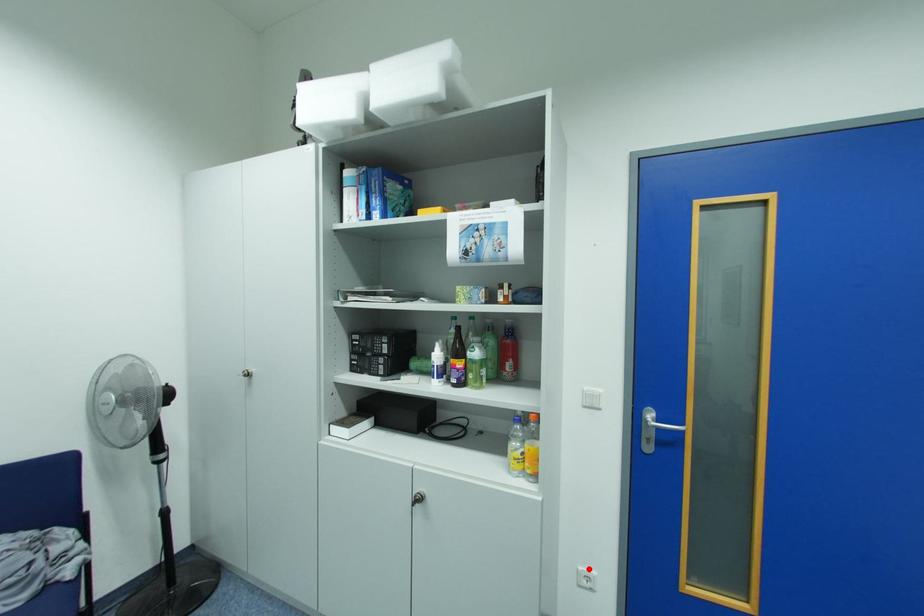
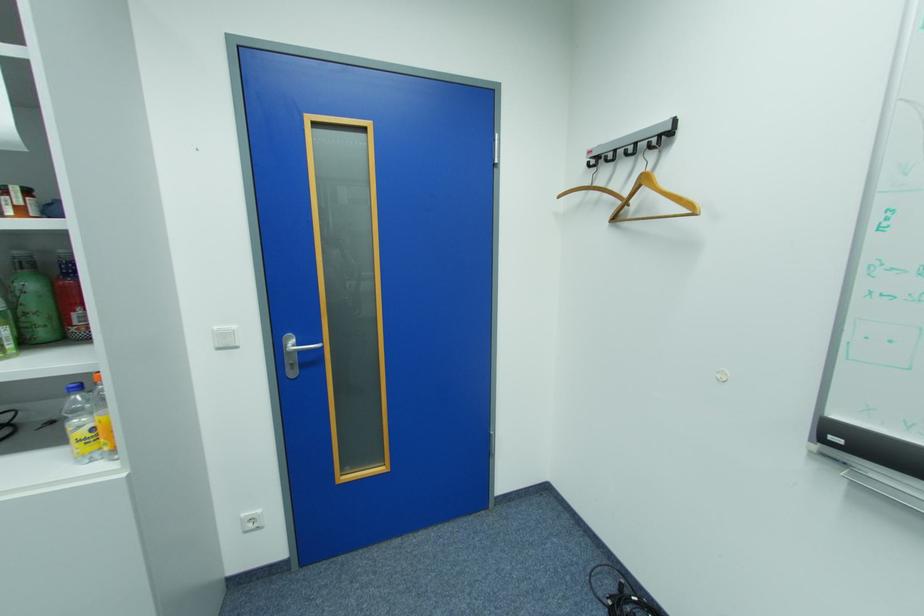
The point at the highlighted location is marked in the first image. Where is the corresponding point in the second image?

(252, 516)